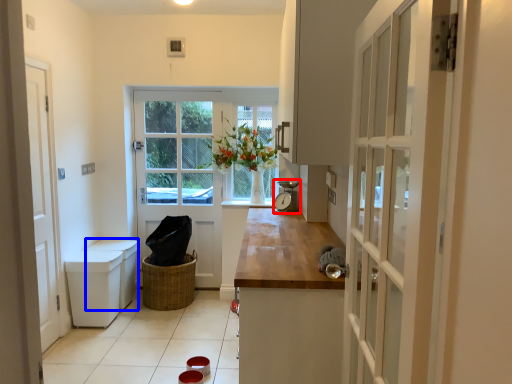
Question: Which object is further to the camera taking this photo, appliance (highlighted by a red box) or cabinetry (highlighted by a blue box)?

Choices:
 (A) appliance
 (B) cabinetry

Answer: (B)